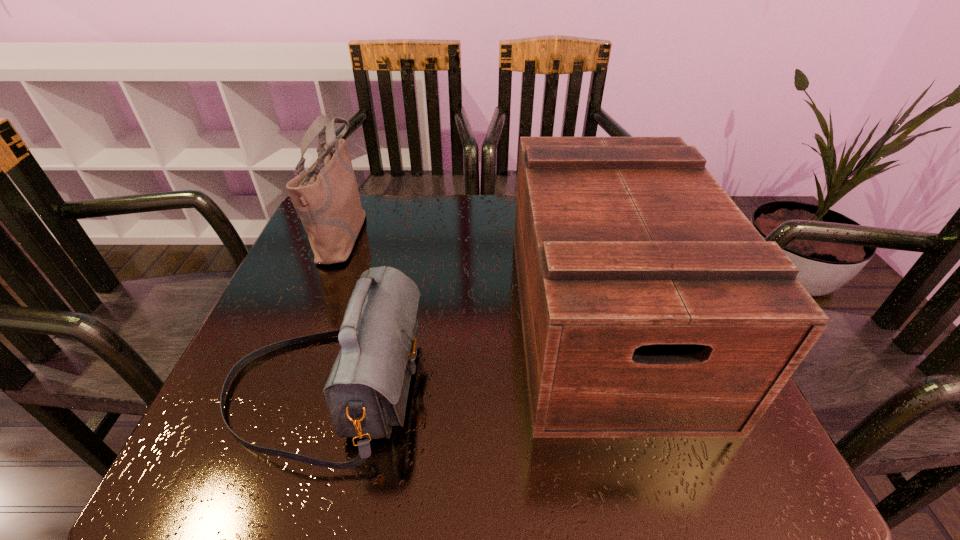
Where is `vacant position in the image that satisfies the following two spatial constraints: 1. on the front-facing side of the rightmost object; 2. on the right side of the taller shoulder bag`? vacant position in the image that satisfies the following two spatial constraints: 1. on the front-facing side of the rightmost object; 2. on the right side of the taller shoulder bag is located at coordinates (310, 316).

You are a GUI agent. You are given a task and a screenshot of the screen. Output one action in this format:
    pyautogui.click(x=<x>, y=<y>)
    Task: Click on the vacant space that satisfies the following two spatial constraints: 1. on the front-facing side of the nearer shoulder bag; 2. on the left side of the farther shoulder bag
    
    Given the screenshot: What is the action you would take?
    pyautogui.click(x=281, y=388)

Locate an element on the screen. Image resolution: width=960 pixels, height=540 pixels. free spot that satisfies the following two spatial constraints: 1. on the front-facing side of the farther shoulder bag; 2. on the right side of the shorter shoulder bag is located at coordinates (281, 388).